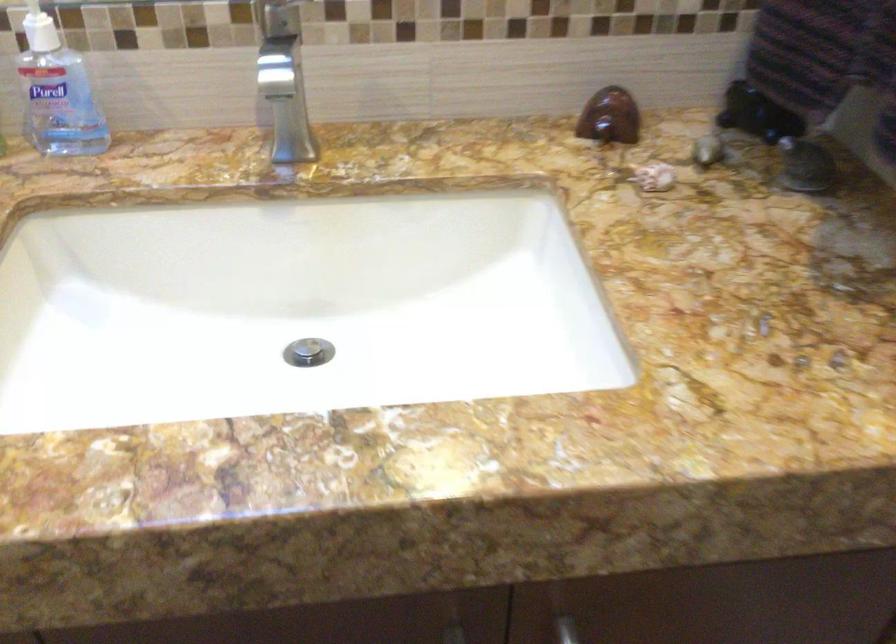
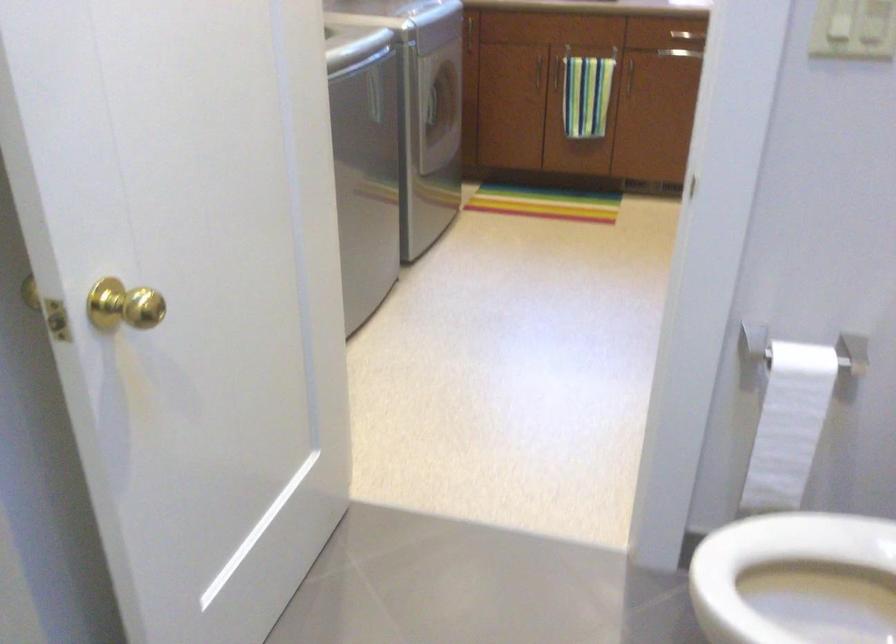
First-person continuous shooting, in which direction is the camera rotating?

The camera rotated toward left-down.